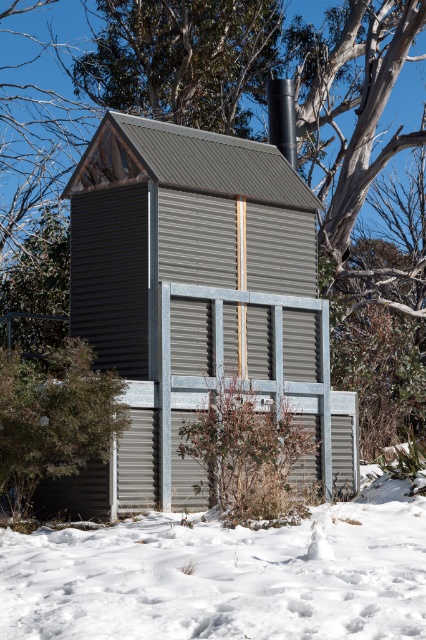
Can you confirm if gray corrugated metal hut at center is smaller than green leafy shrub at lower left?

Correct, gray corrugated metal hut at center occupies less space than green leafy shrub at lower left.

This screenshot has height=640, width=426. What do you see at coordinates (201, 296) in the screenshot? I see `gray corrugated metal hut at center` at bounding box center [201, 296].

Describe the element at coordinates (201, 296) in the screenshot. I see `gray corrugated metal hut at center` at that location.

Identify the location of gray corrugated metal hut at center. (201, 296).

Which of these two, white powdery snow at lower center or green leafy shrub at lower left, stands taller?

With more height is green leafy shrub at lower left.

Is white powdery snow at lower center wider than green leafy shrub at lower left?

No.

Is point (411, 632) behind point (49, 452)?

No, it is in front of (49, 452).

Find the location of a particular element. Image resolution: width=426 pixels, height=640 pixels. white powdery snow at lower center is located at coordinates (224, 576).

Can you confirm if gray corrugated metal hut at center is positioned to the right of white powdery snow at lower center?

Indeed, gray corrugated metal hut at center is positioned on the right side of white powdery snow at lower center.

Which is in front, point (180, 211) or point (207, 579)?

Point (207, 579)

The width and height of the screenshot is (426, 640). Describe the element at coordinates (201, 296) in the screenshot. I see `gray corrugated metal hut at center` at that location.

Find the location of a particular element. The width and height of the screenshot is (426, 640). gray corrugated metal hut at center is located at coordinates (201, 296).